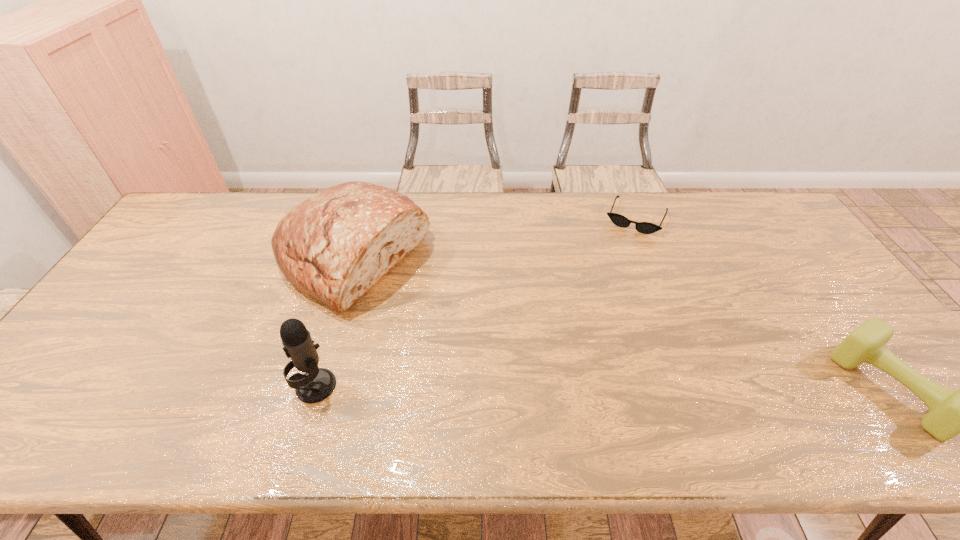
Where is `free space between the second object from right to left and the bread`? free space between the second object from right to left and the bread is located at coordinates (494, 238).

The width and height of the screenshot is (960, 540). In order to click on vacant space that is in between the shortest object and the microphone in this screenshot , I will do `click(476, 302)`.

In order to click on empty location between the shortest object and the microphone in this screenshot , I will do `click(476, 302)`.

Where is `object that ranks as the third closest to the microphone`? object that ranks as the third closest to the microphone is located at coordinates (951, 413).

Identify which object is located as the second nearest to the second shortest object. Please provide its 2D coordinates. Your answer should be formatted as a tuple, i.e. [(x, y)], where the tuple contains the x and y coordinates of a point satisfying the conditions above.

[(335, 246)]